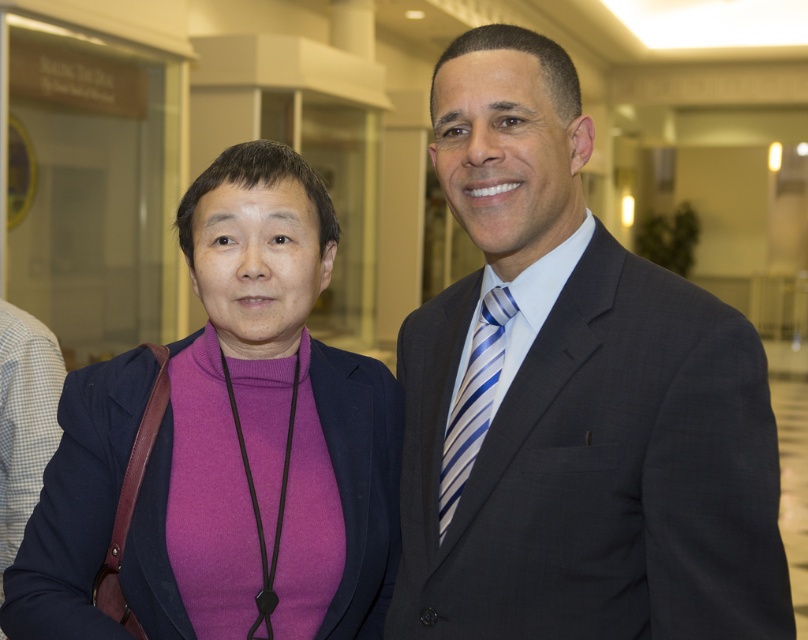
Question: Among these objects, which one is nearest to the camera?

Choices:
 (A) purple matte sweater at center
 (B) dark gray suit at center

Answer: (B)

Question: Is dark gray suit at center wider than purple matte sweater at center?

Choices:
 (A) yes
 (B) no

Answer: (B)

Question: From the image, what is the correct spatial relationship of dark gray suit at center in relation to blue striped tie at center?

Choices:
 (A) above
 (B) below

Answer: (A)

Question: Which object is the farthest from the purple matte sweater at center?

Choices:
 (A) dark gray suit at center
 (B) blue striped tie at center

Answer: (B)

Question: Observing the image, what is the correct spatial positioning of dark gray suit at center in reference to purple matte sweater at center?

Choices:
 (A) right
 (B) left

Answer: (A)

Question: Which object is closer to the camera taking this photo?

Choices:
 (A) blue striped tie at center
 (B) dark gray suit at center

Answer: (B)